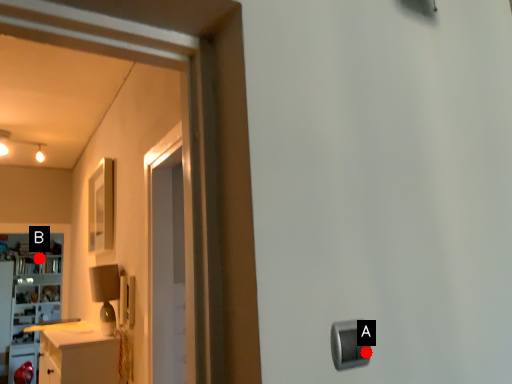
Question: Two points are circled on the image, labeled by A and B beside each circle. Which of the following is the closest to the observer?

Choices:
 (A) A is closer
 (B) B is closer

Answer: (A)